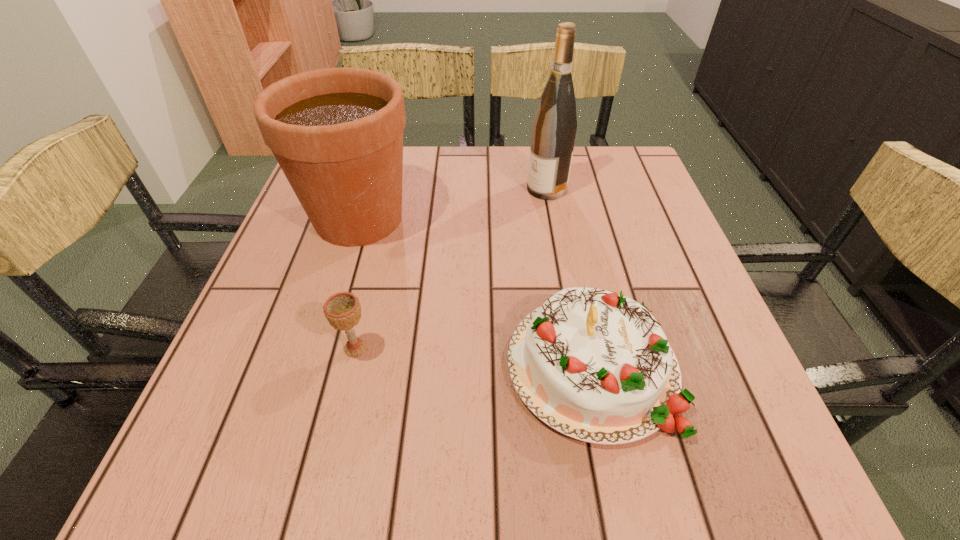
I want to click on vacant space at the far right corner of the desktop, so click(x=599, y=165).

At what (x,y) coordinates should I click in order to perform the action: click on free spot between the flowerpot and the cake. Please return your answer as a coordinate pair (x, y). Image resolution: width=960 pixels, height=540 pixels. Looking at the image, I should click on (475, 292).

Locate an element on the screen. The width and height of the screenshot is (960, 540). empty space between the third shortest object and the wine bottle is located at coordinates 453,204.

In order to click on free space between the tallest object and the chalice in this screenshot , I will do `click(451, 268)`.

Locate an element on the screen. vacant area that lies between the chalice and the third tallest object is located at coordinates (473, 357).

Locate an element on the screen. The width and height of the screenshot is (960, 540). free spot between the shortest object and the third tallest object is located at coordinates (473, 357).

Identify the location of vacant space that's between the wine bottle and the third shortest object. (453, 204).

I want to click on free spot between the cake and the wine bottle, so click(569, 278).

Identify the location of vacant area that lies between the cake and the wine bottle. This screenshot has height=540, width=960. (569, 278).

Where is `free point between the cake and the tallest object`? The width and height of the screenshot is (960, 540). free point between the cake and the tallest object is located at coordinates (569, 278).